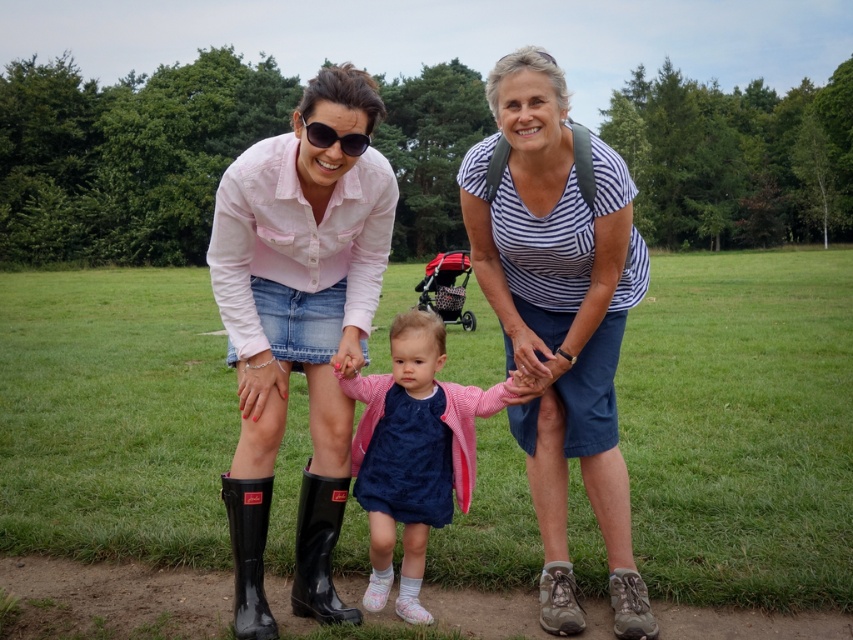
Question: Which point is farther from the camera taking this photo?

Choices:
 (A) (297, 512)
 (B) (555, 211)

Answer: (A)

Question: Which of these objects is positioned closest to the matte black sunglasses at center?

Choices:
 (A) matte pink shirt at center
 (B) striped cotton shirt at center

Answer: (A)

Question: Does pink fabric dress at center have a larger size compared to matte black sunglasses at center?

Choices:
 (A) no
 (B) yes

Answer: (B)

Question: Which object is closer to the camera taking this photo?

Choices:
 (A) pink fabric dress at center
 (B) matte black boots at lower left

Answer: (A)

Question: In this image, where is pink fabric dress at center located relative to black rubber boot at lower left?

Choices:
 (A) right
 (B) left

Answer: (A)

Question: Can you confirm if pink fabric dress at center is positioned above rubber boots at lower center?

Choices:
 (A) no
 (B) yes

Answer: (B)